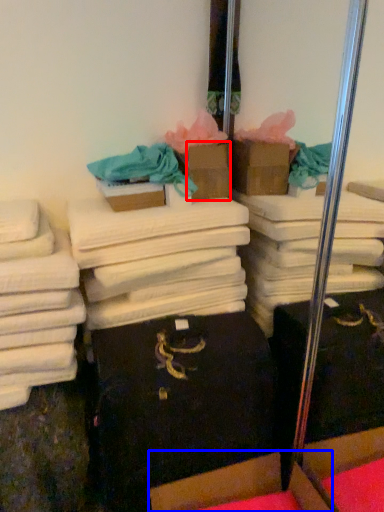
Question: Among these objects, which one is nearest to the camera, cardboard box (highlighted by a red box) or cardboard box (highlighted by a blue box)?

Choices:
 (A) cardboard box
 (B) cardboard box

Answer: (B)